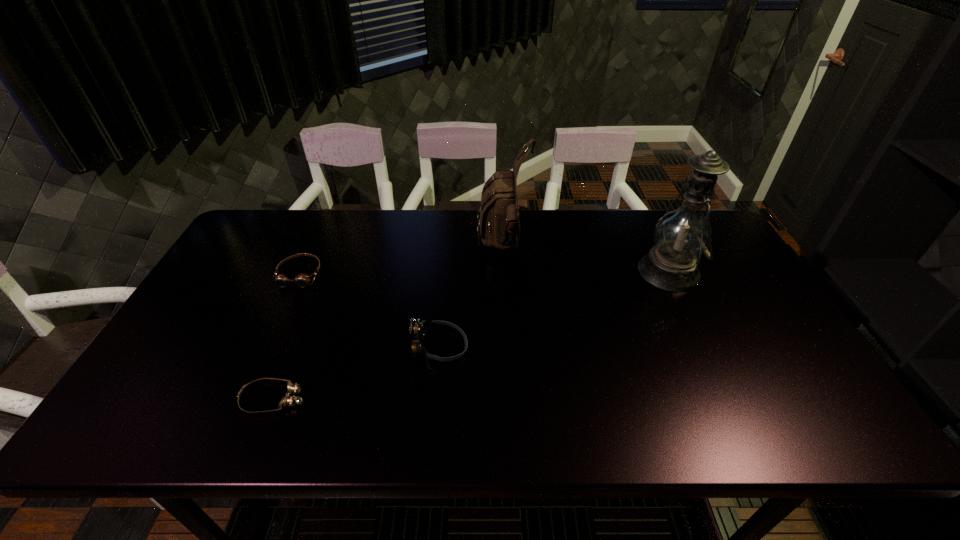
This screenshot has width=960, height=540. I want to click on goggles identified as the closest to the farthest goggles, so click(x=288, y=400).

Where is `free spot that satisfies the following two spatial constraints: 1. on the front-facing side of the second object from right to left; 2. on the right side of the oil lamp`? Image resolution: width=960 pixels, height=540 pixels. free spot that satisfies the following two spatial constraints: 1. on the front-facing side of the second object from right to left; 2. on the right side of the oil lamp is located at coordinates (506, 271).

At what (x,y) coordinates should I click in order to perform the action: click on vacant space that satisfies the following two spatial constraints: 1. on the front-facing side of the shoulder bag; 2. through the lenses of the second shortest object. Please return your answer as a coordinate pair (x, y). The height and width of the screenshot is (540, 960). Looking at the image, I should click on (506, 274).